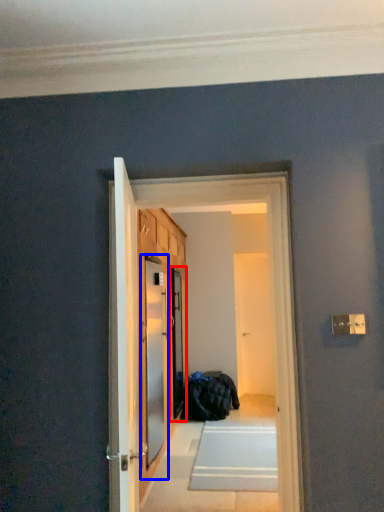
Question: Which point is further to the camera, screen door (highlighted by a red box) or screen door (highlighted by a blue box)?

Choices:
 (A) screen door
 (B) screen door

Answer: (A)